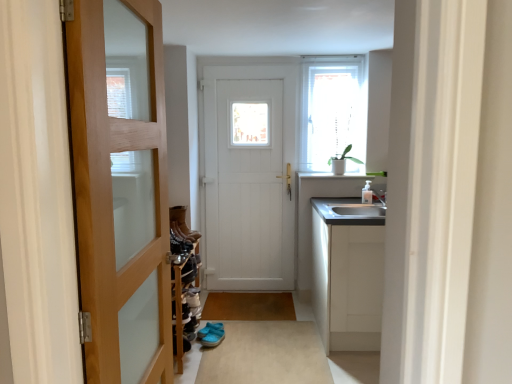
Measure the distance between brown matte mat at center, marked as the 1th plain in a back-to-front arrangement, and camera.

3.28 meters.

The image size is (512, 384). Describe the element at coordinates (249, 306) in the screenshot. I see `brown matte mat at center, marked as the 2th plain in a front-to-back arrangement` at that location.

Where is `wooden door at left, placed as the first door when sorted from front to back`? The image size is (512, 384). wooden door at left, placed as the first door when sorted from front to back is located at coordinates point(120,205).

The width and height of the screenshot is (512, 384). In order to click on brown matte mat at center, marked as the 1th plain in a back-to-front arrangement in this screenshot , I will do `click(249, 306)`.

Between blue fabric sandals at center and brown matte mat at center, marked as the 2th plain in a front-to-back arrangement, which one has less height?

brown matte mat at center, marked as the 2th plain in a front-to-back arrangement.

From the image's perspective, which one is positioned higher, blue fabric sandals at center or brown matte mat at center, the second plain ordered from the bottom?

From the image's view, brown matte mat at center, the second plain ordered from the bottom, is above.

Looking at this image, could brown matte mat at center, the 1th plain viewed from the top, be considered to be inside blue fabric sandals at center?

Definitely not — brown matte mat at center, the 1th plain viewed from the top, is not inside blue fabric sandals at center.

Is blue fabric sandals at center turned away from brown matte mat at center, the second plain ordered from the bottom?

Yes, blue fabric sandals at center is facing away from brown matte mat at center, the second plain ordered from the bottom.

Does point (172, 374) come in front of point (173, 207)?

That is True.

From the image's perspective, which is below, wooden door at left, placed as the first door when sorted from front to back, or leather boots at center?

leather boots at center appears lower in the image.

Is wooden door at left, placed as the first door when sorted from front to back, next to leather boots at center?

No, wooden door at left, placed as the first door when sorted from front to back, is not in contact with leather boots at center.

What are the coordinates of `door in front of the leather boots at center` in the screenshot? It's located at (120, 205).

Does leather boots at center turn towards blue fabric sandals at center?

No, leather boots at center is not facing towards blue fabric sandals at center.

Could blue fabric sandals at center be considered to be inside leather boots at center?

Definitely not — blue fabric sandals at center is not inside leather boots at center.

From the image's perspective, which is above, leather boots at center or blue fabric sandals at center?

leather boots at center, from the image's perspective.

Considering the relative sizes of leather boots at center and blue fabric sandals at center in the image provided, is leather boots at center smaller than blue fabric sandals at center?

Incorrect, leather boots at center is not smaller in size than blue fabric sandals at center.

From a real-world perspective, is white wooden door at center, the second door from the front, positioned above or below wooden door at left, placed as the first door when sorted from front to back?

In terms of real-world spatial position, white wooden door at center, the second door from the front, is below wooden door at left, placed as the first door when sorted from front to back.

Does white wooden door at center, which appears as the first door when viewed from the back, come behind wooden door at left, acting as the 2th door starting from the back?

Yes, white wooden door at center, which appears as the first door when viewed from the back, is further from the viewer.

Considering the positions of points (251, 225) and (148, 154), is point (251, 225) closer to camera compared to point (148, 154)?

No.

Does white wooden door at center, which appears as the first door when viewed from the back, appear on the right side of wooden door at left, placed as the first door when sorted from front to back?

Yes.

From the image's perspective, is satin white cabinet at right positioned above or below blue fabric sandals at center?

Based on their image positions, satin white cabinet at right is located above blue fabric sandals at center.

Does satin white cabinet at right appear on the left side of blue fabric sandals at center?

Incorrect, satin white cabinet at right is not on the left side of blue fabric sandals at center.

Find the location of a particular element. This screenshot has height=384, width=512. footwear lying below the satin white cabinet at right (from the image's perspective) is located at coordinates (212, 337).

Does leather boots at center have a greater height compared to brown matte mat at center, the 1th plain viewed from the top?

Yes.

Looking at this image, is leather boots at center oriented away from brown matte mat at center, marked as the 2th plain in a front-to-back arrangement?

No.

From the image's perspective, is leather boots at center positioned above or below brown matte mat at center, marked as the 1th plain in a back-to-front arrangement?

Clearly, from the image's perspective, leather boots at center is above brown matte mat at center, marked as the 1th plain in a back-to-front arrangement.

Between point (188, 230) and point (263, 298), which one is positioned behind?

The point (263, 298) is behind.

In the image, is brown matte mat at center, marked as the 1th plain in a back-to-front arrangement, on the left side or the right side of translucent glass window at upper right?

brown matte mat at center, marked as the 1th plain in a back-to-front arrangement, is to the left of translucent glass window at upper right.

How different are the orientations of brown matte mat at center, marked as the 2th plain in a front-to-back arrangement, and translucent glass window at upper right in degrees?

The facing directions of brown matte mat at center, marked as the 2th plain in a front-to-back arrangement, and translucent glass window at upper right are 0.474 degrees apart.

Looking at the image, does brown matte mat at center, marked as the 1th plain in a back-to-front arrangement, seem bigger or smaller compared to translucent glass window at upper right?

In the image, brown matte mat at center, marked as the 1th plain in a back-to-front arrangement, appears to be smaller than translucent glass window at upper right.

From the image's perspective, starting from the translucent glass window at upper right, which plain is the 1st one below? Please provide its 2D coordinates.

[(249, 306)]

This screenshot has height=384, width=512. I want to click on footwear on the left of brown matte mat at center, the second plain ordered from the bottom, so click(x=212, y=337).

Locate an element on the screen. This screenshot has width=512, height=384. door located in front of the leather boots at center is located at coordinates (120, 205).

Which object lies further to the anchor point brown matte mat at center, the second plain ordered from the bottom, satin white cabinet at right or white wooden door at center, which appears as the first door when viewed from the back?

white wooden door at center, which appears as the first door when viewed from the back, is further to brown matte mat at center, the second plain ordered from the bottom.

Which object lies further to the anchor point beige carpet at center, the 2th plain viewed from the top, translucent glass window at upper right or white wooden door at center, the second door from the front?

translucent glass window at upper right.

Looking at the image, which one is located closer to satin white cabinet at right, brown matte mat at center, the second plain ordered from the bottom, or white wooden door at center, the second door from the front?

brown matte mat at center, the second plain ordered from the bottom, is closer to satin white cabinet at right.

Looking at the image, which one is located further to brown matte mat at center, the 1th plain viewed from the top, wooden door at left, placed as the first door when sorted from front to back, or translucent glass window at upper right?

wooden door at left, placed as the first door when sorted from front to back, is further to brown matte mat at center, the 1th plain viewed from the top.

Estimate the real-world distances between objects in this image. Which object is closer to satin white cabinet at right, beige carpet at center, the 2th plain viewed from the top, or blue fabric sandals at center?

beige carpet at center, the 2th plain viewed from the top, is closer to satin white cabinet at right.

Based on their spatial positions, is beige carpet at center, placed as the 2th plain when sorted from back to front, or white wooden door at center, which appears as the first door when viewed from the back, further from blue fabric sandals at center?

white wooden door at center, which appears as the first door when viewed from the back, is further to blue fabric sandals at center.

From the image, which object appears to be farther from blue fabric sandals at center, leather boots at center or translucent glass window at upper right?

translucent glass window at upper right is positioned further to the anchor blue fabric sandals at center.

Based on their spatial positions, is blue fabric sandals at center or beige carpet at center, the first plain from the bottom, closer to leather boots at center?

blue fabric sandals at center.

Where is `shoe between wooden door at left, acting as the 2th door starting from the back, and brown matte mat at center, marked as the 1th plain in a back-to-front arrangement, in the front-back direction`? The height and width of the screenshot is (384, 512). shoe between wooden door at left, acting as the 2th door starting from the back, and brown matte mat at center, marked as the 1th plain in a back-to-front arrangement, in the front-back direction is located at coordinates (181, 224).

Identify the location of shoe between white wooden door at center, the second door from the front, and blue fabric sandals at center, in the vertical direction. (181, 224).

Find the location of a particular element. This screenshot has width=512, height=384. plain between wooden door at left, placed as the first door when sorted from front to back, and brown matte mat at center, marked as the 2th plain in a front-to-back arrangement, from front to back is located at coordinates (266, 354).

Find the location of a particular element. Image resolution: width=512 pixels, height=384 pixels. plain between white wooden door at center, the second door from the front, and blue fabric sandals at center vertically is located at coordinates (249, 306).